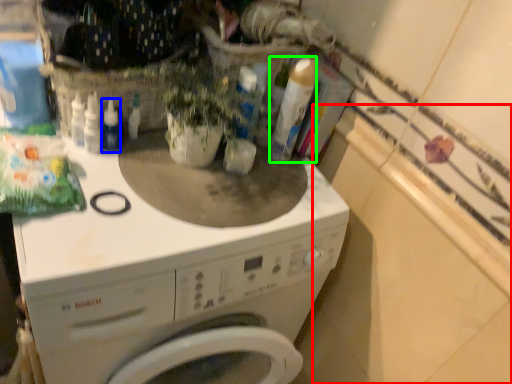
Question: Estimate the real-world distances between objects in this image. Which object is farther from counter top (highlighted by a red box), bottle (highlighted by a blue box) or cleaning product (highlighted by a green box)?

Choices:
 (A) bottle
 (B) cleaning product

Answer: (A)